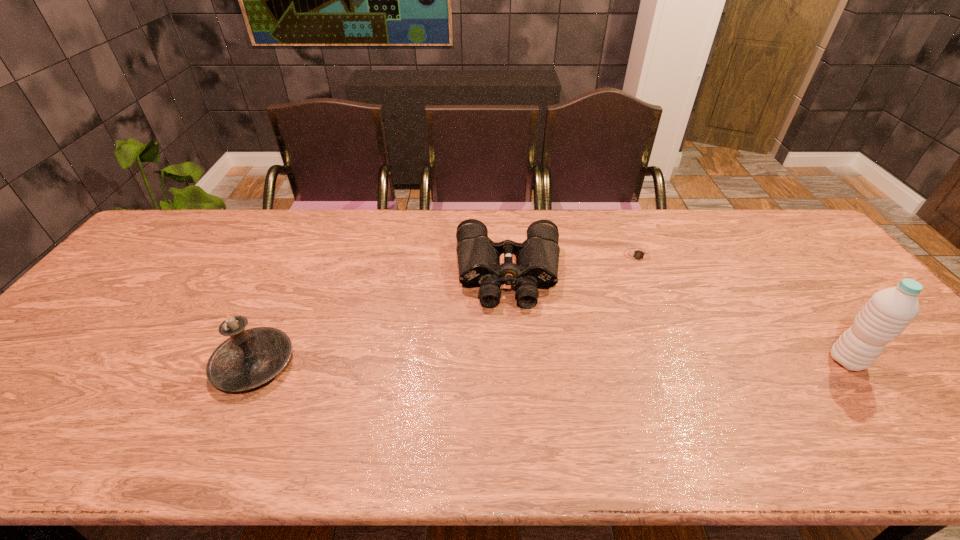
Where is `free point between the shortest object and the tallest object`? The width and height of the screenshot is (960, 540). free point between the shortest object and the tallest object is located at coordinates (743, 307).

Find the location of a particular element. Image resolution: width=960 pixels, height=540 pixels. free spot between the binoculars and the leftmost object is located at coordinates (381, 319).

Find the location of `free space between the third object from right to left and the watch`. free space between the third object from right to left and the watch is located at coordinates (574, 265).

The image size is (960, 540). Identify the location of unoccupied position between the rightmost object and the third tallest object. (678, 318).

Identify the location of empty space that is in between the shortest object and the water bottle. (743, 307).

I want to click on object that ranks as the closest to the candle, so click(537, 258).

This screenshot has width=960, height=540. Find the location of `object that is the closest to the second tallest object`. object that is the closest to the second tallest object is located at coordinates (537, 258).

Locate an element on the screen. The image size is (960, 540). vacant space that satisfies the following two spatial constraints: 1. on the back side of the binoculars; 2. on the left side of the candle is located at coordinates (296, 274).

The height and width of the screenshot is (540, 960). I want to click on vacant area that satisfies the following two spatial constraints: 1. on the front side of the watch; 2. on the right side of the rightmost object, so click(684, 361).

Locate an element on the screen. vacant point that satisfies the following two spatial constraints: 1. on the back side of the second tallest object; 2. on the right side of the tallest object is located at coordinates (255, 361).